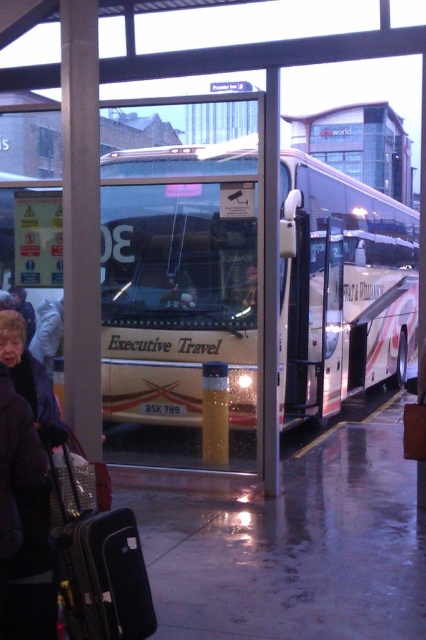
Question: Does white glossy bus at center appear on the right side of black hard suitcase at lower left?

Choices:
 (A) no
 (B) yes

Answer: (B)

Question: Can you confirm if white glossy bus at center is positioned below black hard suitcase at lower left?

Choices:
 (A) no
 (B) yes

Answer: (A)

Question: Among these objects, which one is nearest to the camera?

Choices:
 (A) white glossy bus at center
 (B) black hard suitcase at lower left

Answer: (B)

Question: Which object is farther from the camera taking this photo?

Choices:
 (A) black hard suitcase at lower left
 (B) white glossy bus at center

Answer: (B)

Question: Does white glossy bus at center have a lesser width compared to black hard suitcase at lower left?

Choices:
 (A) no
 (B) yes

Answer: (B)